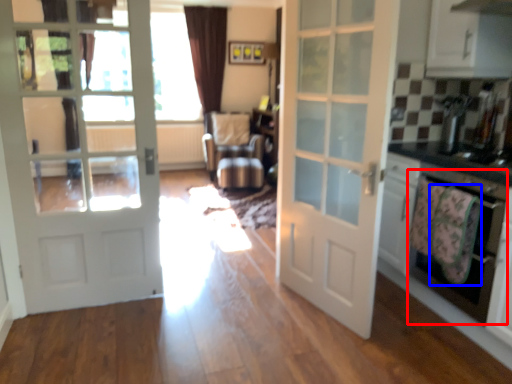
Question: Which object is closer to the camera taking this photo, oven (highlighted by a red box) or blanket (highlighted by a blue box)?

Choices:
 (A) oven
 (B) blanket

Answer: (A)